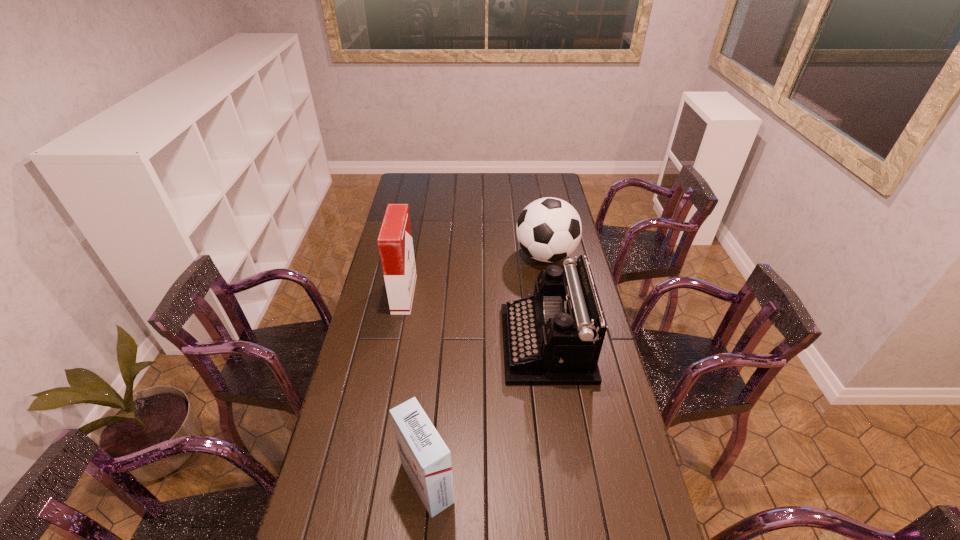
Find the location of a particular element. Image resolution: width=960 pixels, height=540 pixels. free spot between the tallest object and the soccer ball is located at coordinates (475, 275).

Locate an element on the screen. Image resolution: width=960 pixels, height=540 pixels. unoccupied position between the taller cigarette case and the right cigarette case is located at coordinates (416, 388).

At what (x,y) coordinates should I click in order to perform the action: click on free space that is in between the right cigarette case and the typewriter. Please return your answer as a coordinate pair (x, y). Looking at the image, I should click on (487, 413).

The image size is (960, 540). In order to click on free point between the soccer ball and the farther cigarette case in this screenshot , I will do `click(475, 275)`.

Find the location of a particular element. free area in between the typewriter and the shorter cigarette case is located at coordinates (487, 413).

At what (x,y) coordinates should I click in order to perform the action: click on free area in between the soccer ball and the nearer cigarette case. Please return your answer as a coordinate pair (x, y). Image resolution: width=960 pixels, height=540 pixels. Looking at the image, I should click on (487, 369).

In order to click on free space between the soccer ball and the farther cigarette case in this screenshot , I will do `click(475, 275)`.

The height and width of the screenshot is (540, 960). What are the coordinates of `object that can be found as the closest to the right cigarette case` in the screenshot? It's located at (555, 337).

Find the location of `object that stands as the third closest to the typewriter`. object that stands as the third closest to the typewriter is located at coordinates (395, 243).

This screenshot has height=540, width=960. In order to click on vacant space that satisfies the following two spatial constraints: 1. on the back side of the nearest object; 2. on the front-facing side of the farther cigarette case in this screenshot , I will do `click(444, 294)`.